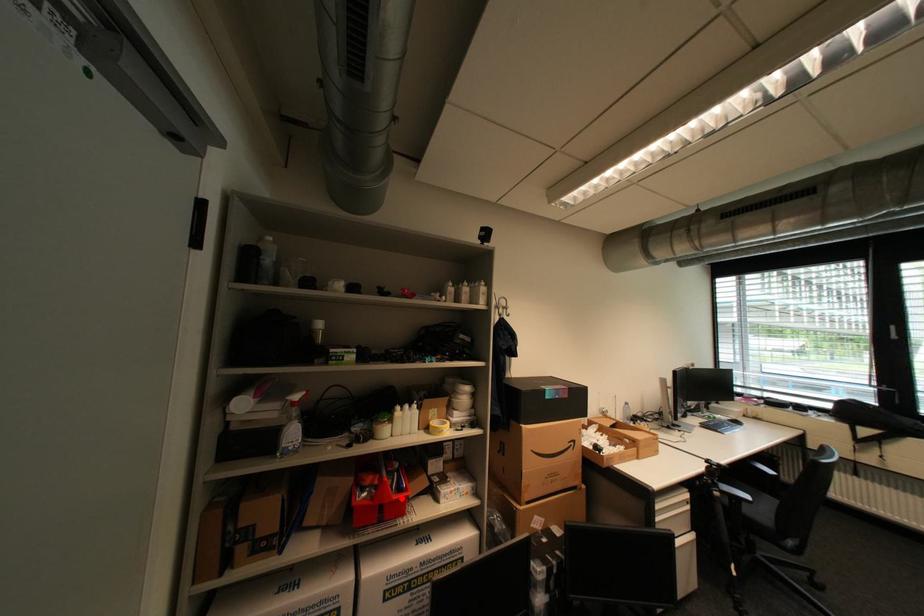
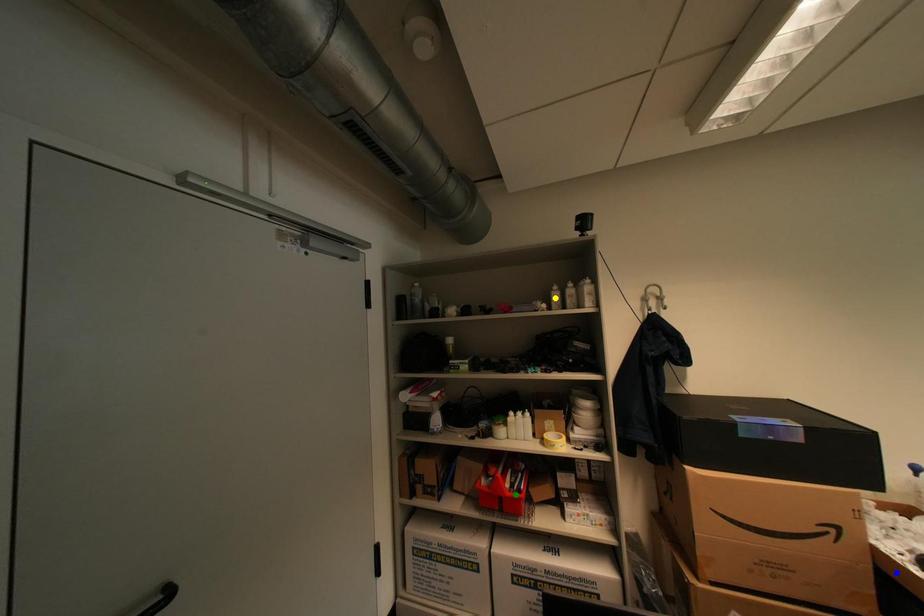
Question: I am providing you with two images of the same scene from different viewpoints. A red point is marked on the first image. You are given multiple points on the second image. Which point in image 2 is actually the same real-world point as the red point in image 1?

Choices:
 (A) yellow point
 (B) blue point
 (C) green point

Answer: (C)